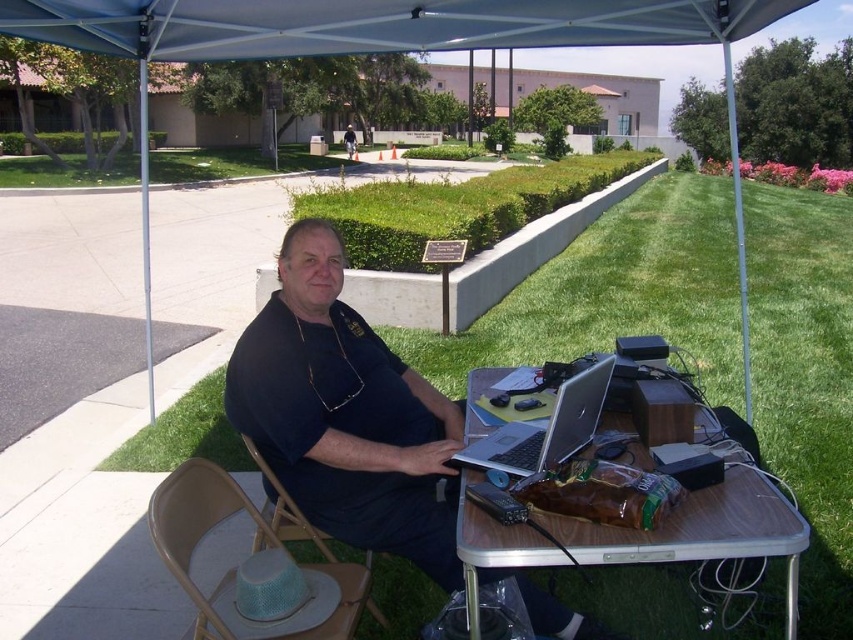
Who is lower down, green mesh chair at lower center or matte black shirt at center?

green mesh chair at lower center is below.

Is green mesh chair at lower center taller than matte black shirt at center?

Incorrect, green mesh chair at lower center's height is not larger of matte black shirt at center's.

Does point (270, 474) come in front of point (347, 140)?

Yes, it is.

The width and height of the screenshot is (853, 640). I want to click on green mesh chair at lower center, so click(287, 509).

In the scene shown: Who is positioned more to the left, white fabric canopy at upper center or silver/black laptop at center?

white fabric canopy at upper center is more to the left.

Does white fabric canopy at upper center have a lesser height compared to silver/black laptop at center?

Incorrect, white fabric canopy at upper center's height does not fall short of silver/black laptop at center's.

Which is behind, point (660, 3) or point (512, 442)?

The point (660, 3) is more distant.

Where is `white fabric canopy at upper center`? The image size is (853, 640). white fabric canopy at upper center is located at coordinates (396, 36).

Which is in front, point (704, 513) or point (305, 566)?

Point (704, 513) is in front.

You are a GUI agent. You are given a task and a screenshot of the screen. Output one action in this format:
    pyautogui.click(x=<x>, y=<y>)
    Task: Click on the wooden table at center
    The height and width of the screenshot is (640, 853).
    Given the screenshot: What is the action you would take?
    pyautogui.click(x=701, y=531)